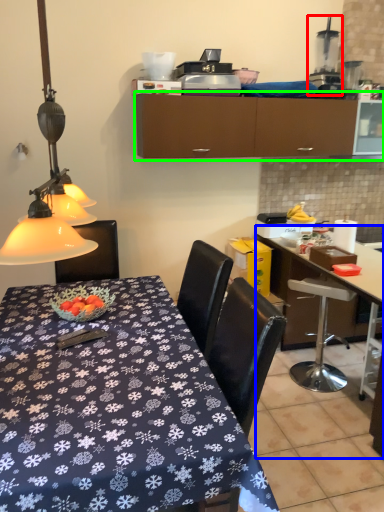
Question: Considering the real-world distances, which object is farthest from appliance (highlighted by a red box)? desk (highlighted by a blue box) or cabinetry (highlighted by a green box)?

Choices:
 (A) desk
 (B) cabinetry

Answer: (A)